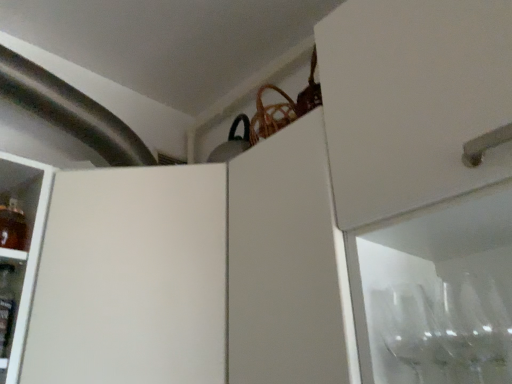
The width and height of the screenshot is (512, 384). What are the coordinates of `white matte cabinet at left` in the screenshot? It's located at (131, 279).

The height and width of the screenshot is (384, 512). Describe the element at coordinates (131, 279) in the screenshot. I see `white matte cabinet at left` at that location.

Identify the location of white matte cabinet at left. (131, 279).